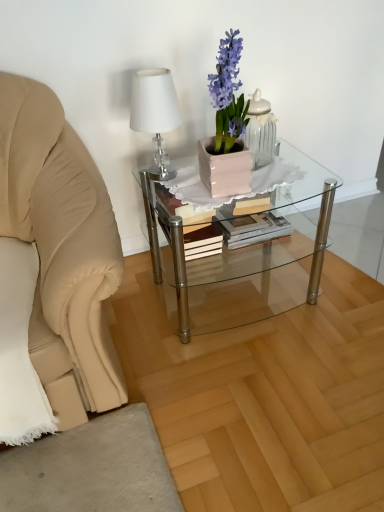
Question: In the image, is white glossy jar at upper center on the left side or the right side of hardcover book at center?

Choices:
 (A) left
 (B) right

Answer: (B)

Question: From the image's perspective, is white glossy jar at upper center located above or below hardcover book at center?

Choices:
 (A) below
 (B) above

Answer: (B)

Question: Based on their relative distances, which object is farther from the clear glass coffee table at center?

Choices:
 (A) white glossy table lamp at upper left
 (B) hardcover book at center
 (C) matte pink pot at center
 (D) white glossy jar at upper center

Answer: (A)

Question: Which is farther from the matte pink pot at center?

Choices:
 (A) clear glass coffee table at center
 (B) white glossy jar at upper center
 (C) white glossy table lamp at upper left
 (D) hardcover book at center

Answer: (A)